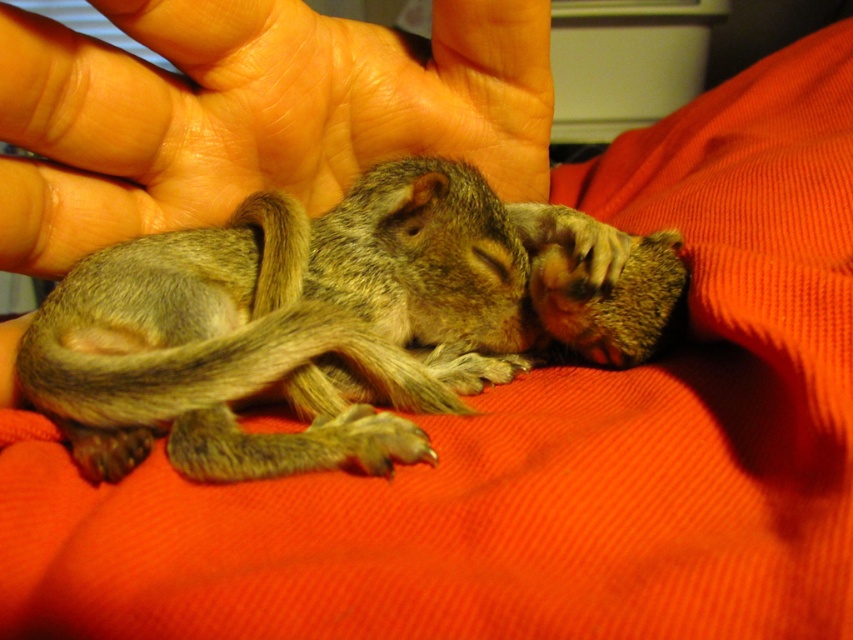
You are a photographer trying to capture the squirrel in the image. You want to focus on the point closer to the camera between point (503, 216) and point (373, 150). Which point should you choose?

Point (503, 216) is closer to the camera than point (373, 150), so you should focus on point (503, 216).